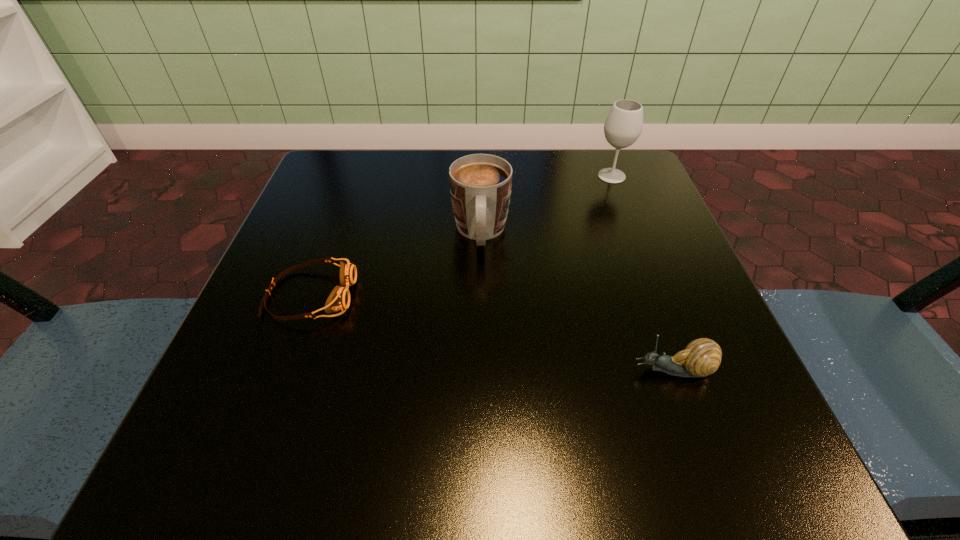
The image size is (960, 540). Find the location of `the tallest object`. the tallest object is located at coordinates (623, 126).

At what (x,y) coordinates should I click in order to perform the action: click on wineglass. Please return your answer as a coordinate pair (x, y). The height and width of the screenshot is (540, 960). Looking at the image, I should click on coord(623,126).

Identify the location of the second object from left to right. (480, 184).

Where is `the second tallest object`? the second tallest object is located at coordinates (480, 184).

You are a GUI agent. You are given a task and a screenshot of the screen. Output one action in this format:
    pyautogui.click(x=<x>, y=<y>)
    Task: Click on the nearest object
    The height and width of the screenshot is (540, 960).
    Given the screenshot: What is the action you would take?
    pyautogui.click(x=701, y=357)

You are a GUI agent. You are given a task and a screenshot of the screen. Output one action in this format:
    pyautogui.click(x=<x>, y=<y>)
    Task: Click on the second shortest object
    
    Given the screenshot: What is the action you would take?
    pyautogui.click(x=701, y=357)

Find the location of a particular element. This screenshot has width=960, height=540. the third farthest object is located at coordinates (339, 299).

Where is `the leftmost object`? Image resolution: width=960 pixels, height=540 pixels. the leftmost object is located at coordinates (339, 299).

Locate an element on the screen. The width and height of the screenshot is (960, 540). vacant space located on the front of the wineglass is located at coordinates (640, 251).

Locate an element on the screen. vacant area situated on the side of the mug with the handle is located at coordinates click(481, 345).